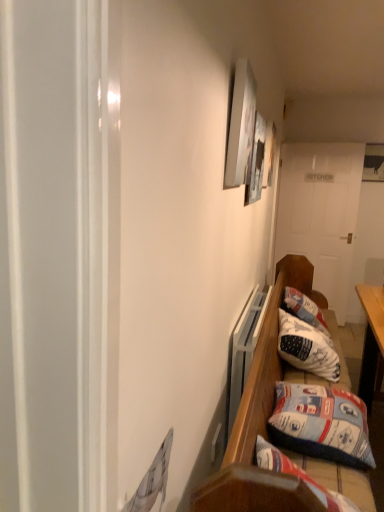
Question: Based on their positions, is white wooden door at center located to the left or right of white fabric pillow at lower right, the 2th pillow in the front-to-back sequence?

Choices:
 (A) left
 (B) right

Answer: (B)

Question: From the image's perspective, is white wooden door at center above or below white fabric pillow at lower right, the 2th pillow in the front-to-back sequence?

Choices:
 (A) below
 (B) above

Answer: (B)

Question: Estimate the real-world distances between objects in this image. Which object is closer to the white wooden door at center?

Choices:
 (A) blue fabric pillow at lower right, which ranks as the first pillow in front-to-back order
 (B) wooden bench at lower right
 (C) white fabric pillow at lower right, the 2th pillow in the front-to-back sequence
 (D) matte white picture frame at upper center, which is the first picture frame in front-to-back order
 (E) metallic silver picture frame at upper center, which is the second picture frame from front to back

Answer: (B)

Question: Which is farther from the matte white picture frame at upper center, which is counted as the second picture frame, starting from the back?

Choices:
 (A) metallic silver picture frame at upper center, arranged as the first picture frame when viewed from the back
 (B) wooden bench at lower right
 (C) white fabric pillow at lower right, the 2th pillow in the front-to-back sequence
 (D) white wooden door at center
 (E) blue fabric pillow at lower right, which ranks as the first pillow in front-to-back order

Answer: (D)